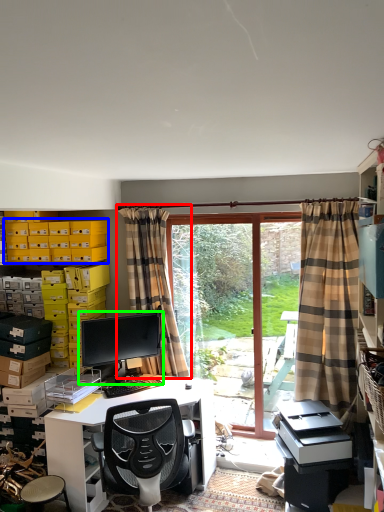
Question: Based on their relative distances, which object is nearer to curtain (highlighted by a red box)? Choose from storage box (highlighted by a blue box) and computer monitor (highlighted by a green box).

Choices:
 (A) storage box
 (B) computer monitor

Answer: (B)